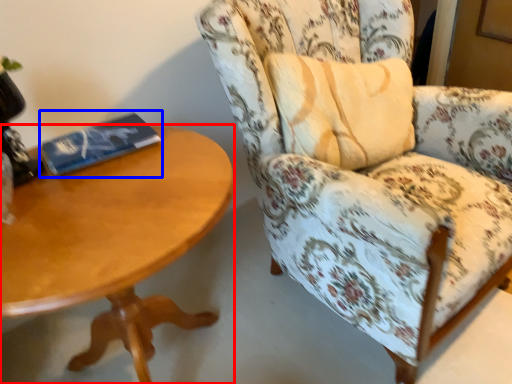
Question: Which point is further to the camera, coffee table (highlighted by a red box) or paperback book (highlighted by a blue box)?

Choices:
 (A) coffee table
 (B) paperback book

Answer: (B)